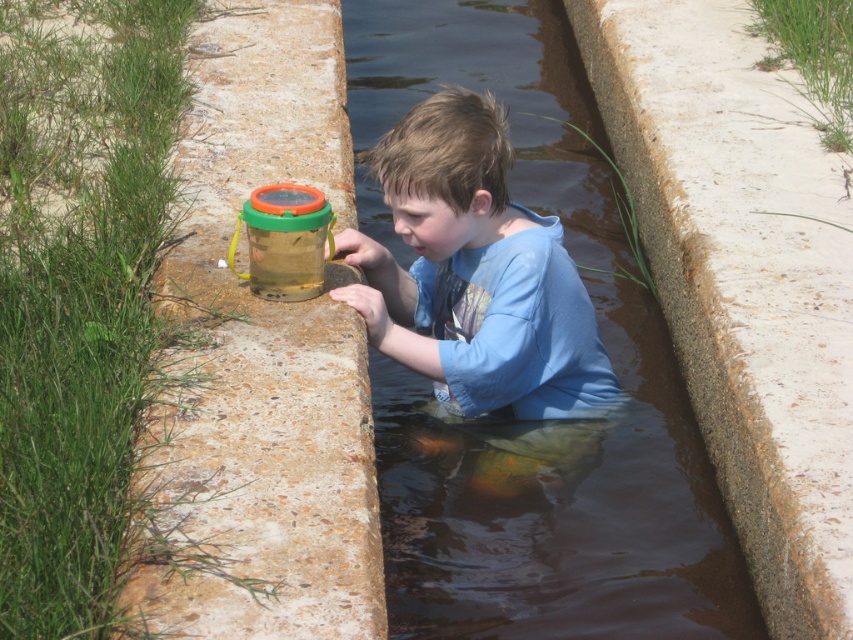
You are the boy in the image. You want to reach the small transparent plastic bucket with a green handle and orange rim on the concrete wall to your left. Considering the height of the rusty concrete ledge at left and the blue cotton shirt at center, can you easily reach the bucket?

The rusty concrete ledge at left is taller than the blue cotton shirt at center. Since the bucket is on the ledge, you may need to stand on the blue cotton shirt at center to reach it, but since the shirt is shorter than the ledge, it might not provide enough height. Alternatively, you might need to find another way to reach the bucket.

You are a safety inspector evaluating the scene. The rusty concrete ledge at left and blue cotton shirt at center are present. Considering their sizes, which object could potentially provide a safer foothold for the boy to climb out of the water channel?

The rusty concrete ledge at left has a larger size compared to the blue cotton shirt at center, so the rusty concrete ledge at left would provide a safer foothold for the boy to climb out of the water channel.